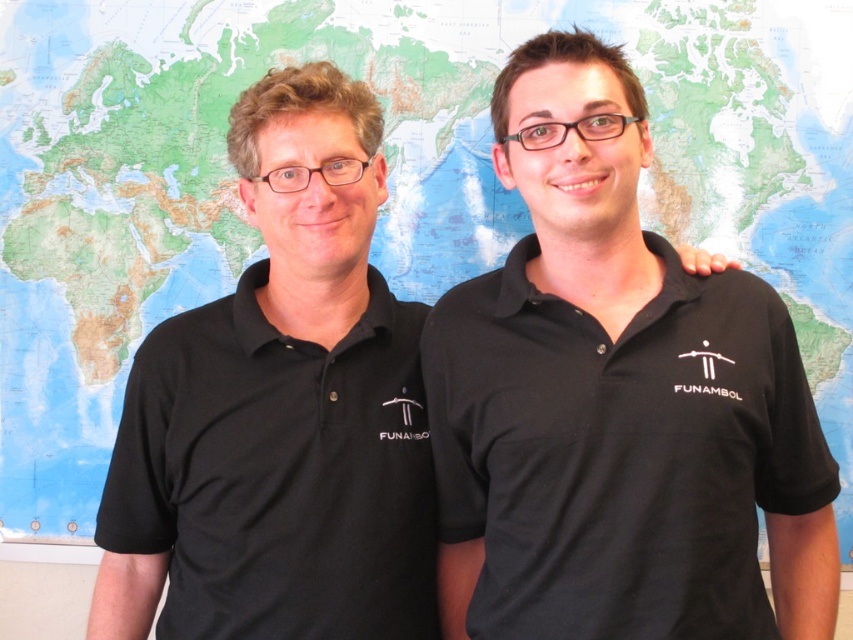
Does black matte shirt at right have a greater height compared to black matte shirt at left?

Incorrect, black matte shirt at right's height is not larger of black matte shirt at left's.

Is the position of black matte shirt at right more distant than that of black matte shirt at left?

That is False.

In the scene shown: Measure the distance between black matte shirt at right and camera.

3.42 feet

At what (x,y) coordinates should I click in order to perform the action: click on black matte shirt at right. Please return your answer as a coordinate pair (x, y). The height and width of the screenshot is (640, 853). Looking at the image, I should click on (616, 403).